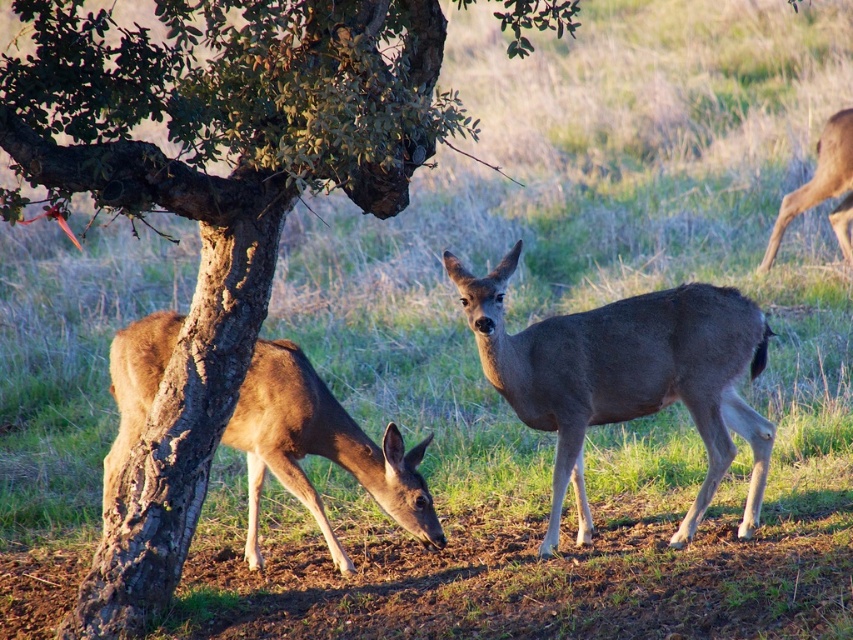
You are a photographer positioned at the origin point in the scene. You want to take a photo of both point (281, 45) and point (390, 484) in the same frame. Which point is closer to you, the photographer?

Point (281, 45) is in front of point (390, 484), so the photographer at the origin would have point (281, 45) closer to them compared to point (390, 484).

You are a hiker trying to locate the smooth bark tree at center in a grassy field with two deer. The coordinates given are point [213,195]. Based on the scene description, where should you look relative to the two deer?

The point [213,195] indicates the location of the smooth bark tree at center. Since the deer on the left is grazing with its head lowered and the deer on the right is standing upright facing forward, the smooth bark tree at center is positioned between them in the middle of the scene.